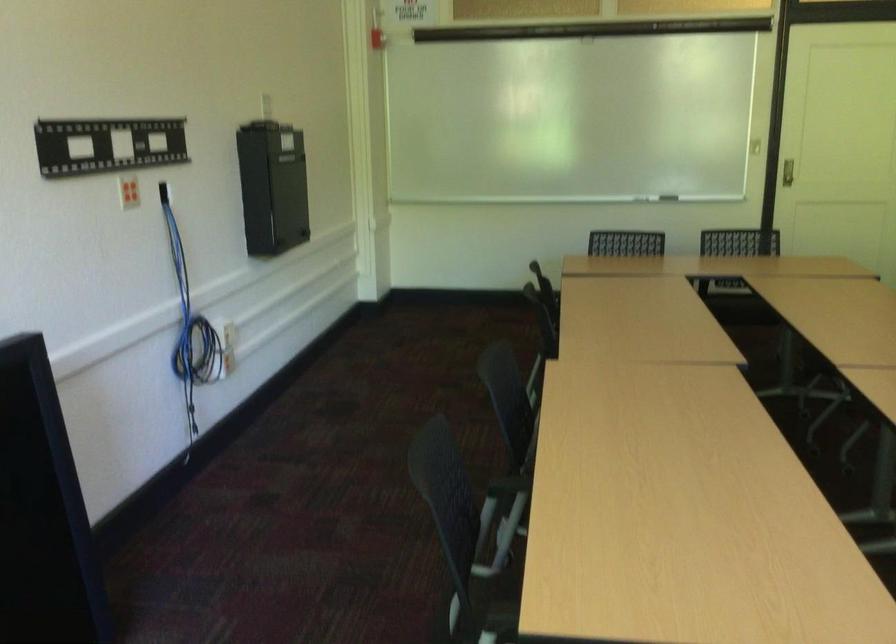
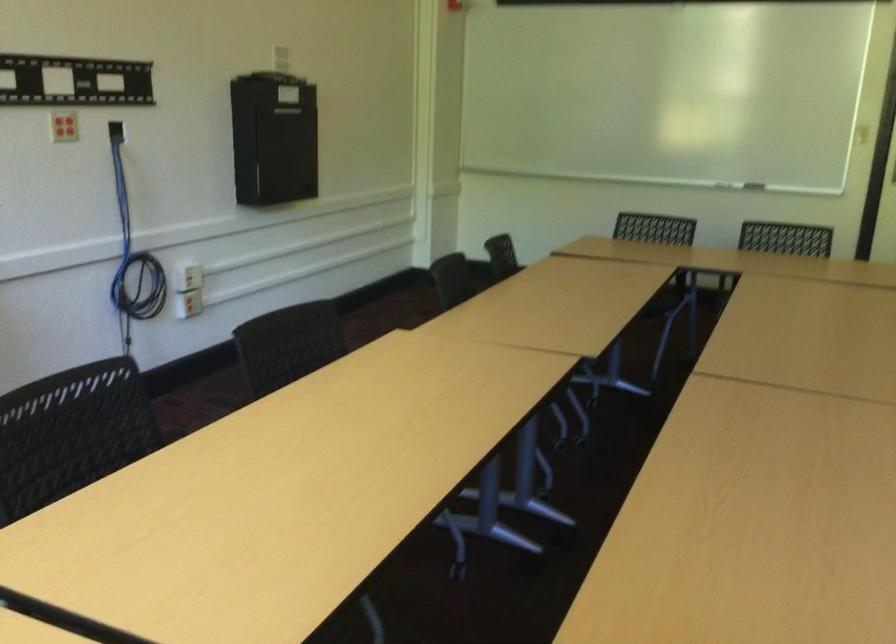
Where in the second image is the point corresponding to the point at 184,317 from the first image?

(133, 252)